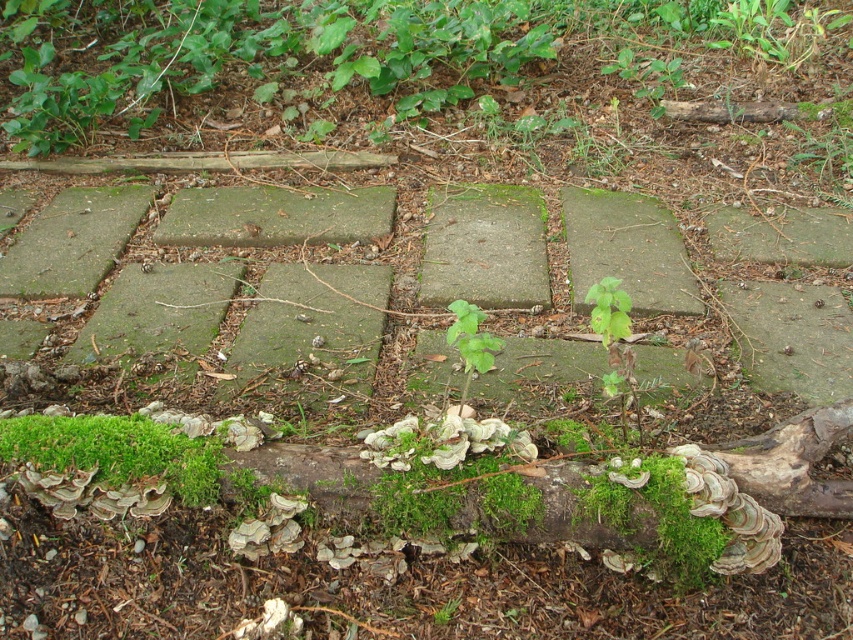
Does green mossy log at upper center have a lesser width compared to green mossy log at lower left?

No, green mossy log at upper center is not thinner than green mossy log at lower left.

Between green mossy log at upper center and green mossy log at lower left, which one has more height?

green mossy log at upper center

Image resolution: width=853 pixels, height=640 pixels. Find the location of `green mossy log at upper center`. green mossy log at upper center is located at coordinates (355, 58).

How much distance is there between green mossy log at lower left and green leafy plant at center?

The distance of green mossy log at lower left from green leafy plant at center is 28.91 inches.

Is point (26, 433) positioned after point (465, 308)?

Yes, point (26, 433) is farther from viewer.

Which is in front, point (33, 452) or point (474, 356)?

Point (474, 356) is more forward.

This screenshot has height=640, width=853. I want to click on green mossy log at lower left, so [x=115, y=451].

Does green mossy log at upper center appear on the left side of green leafy plant at center?

Indeed, green mossy log at upper center is positioned on the left side of green leafy plant at center.

Is point (474, 96) closer to viewer compared to point (459, 310)?

No, (474, 96) is further to viewer.

Locate an element on the screen. green mossy log at upper center is located at coordinates (355, 58).